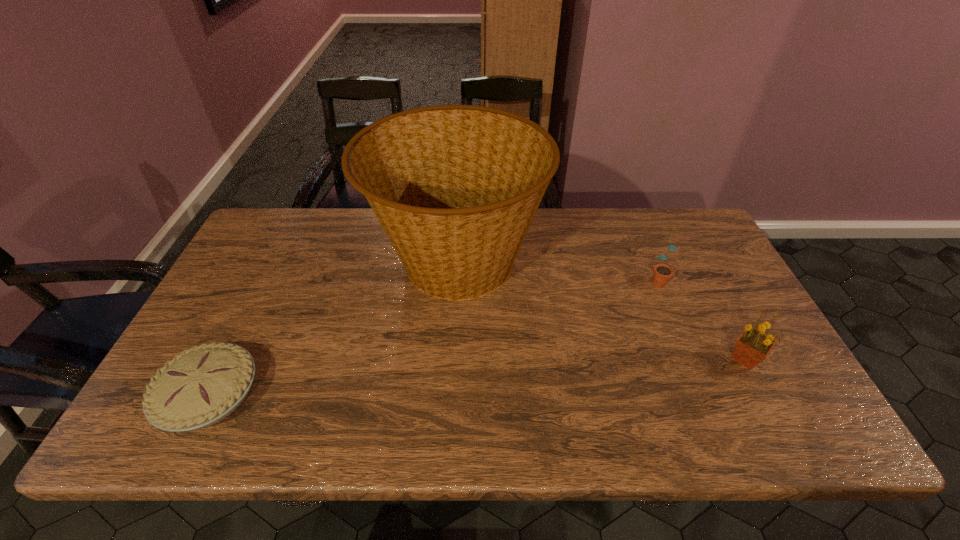
Where is `free space at the near edge`? Image resolution: width=960 pixels, height=540 pixels. free space at the near edge is located at coordinates (475, 423).

This screenshot has width=960, height=540. Find the location of `vacant space at the right edge of the desktop`. vacant space at the right edge of the desktop is located at coordinates (732, 292).

The width and height of the screenshot is (960, 540). In order to click on vacant position at the far left corner of the desktop in this screenshot , I will do `click(304, 224)`.

In the image, there is a desktop. At what (x,y) coordinates should I click in order to perform the action: click on vacant space at the far right corner. Please return your answer as a coordinate pair (x, y). This screenshot has height=540, width=960. Looking at the image, I should click on (702, 237).

I want to click on free spot between the basket and the leftmost object, so click(333, 329).

At what (x,y) coordinates should I click in order to perform the action: click on vacant point located between the basket and the leftmost object. Please return your answer as a coordinate pair (x, y). This screenshot has height=540, width=960. Looking at the image, I should click on (333, 329).

The height and width of the screenshot is (540, 960). In order to click on free area in between the pie and the tallest object in this screenshot , I will do `click(333, 329)`.

Where is `free space that is in between the tallest object and the third object from left to right`? The height and width of the screenshot is (540, 960). free space that is in between the tallest object and the third object from left to right is located at coordinates (557, 271).

Find the location of a particular element. This screenshot has width=960, height=540. vacant space that's between the second object from right to left and the right sunflower is located at coordinates (701, 318).

This screenshot has height=540, width=960. What are the coordinates of `free point between the pie and the right sunflower` in the screenshot? It's located at (477, 377).